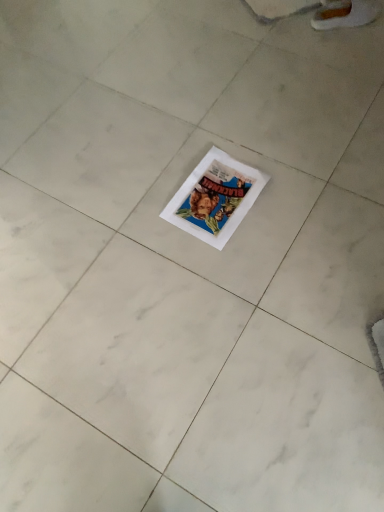
What do you see at coordinates (345, 14) in the screenshot?
I see `white rubber shoe at upper right` at bounding box center [345, 14].

The image size is (384, 512). I want to click on white rubber shoe at upper right, so click(345, 14).

The height and width of the screenshot is (512, 384). In order to click on white rubber shoe at upper right in this screenshot , I will do `click(345, 14)`.